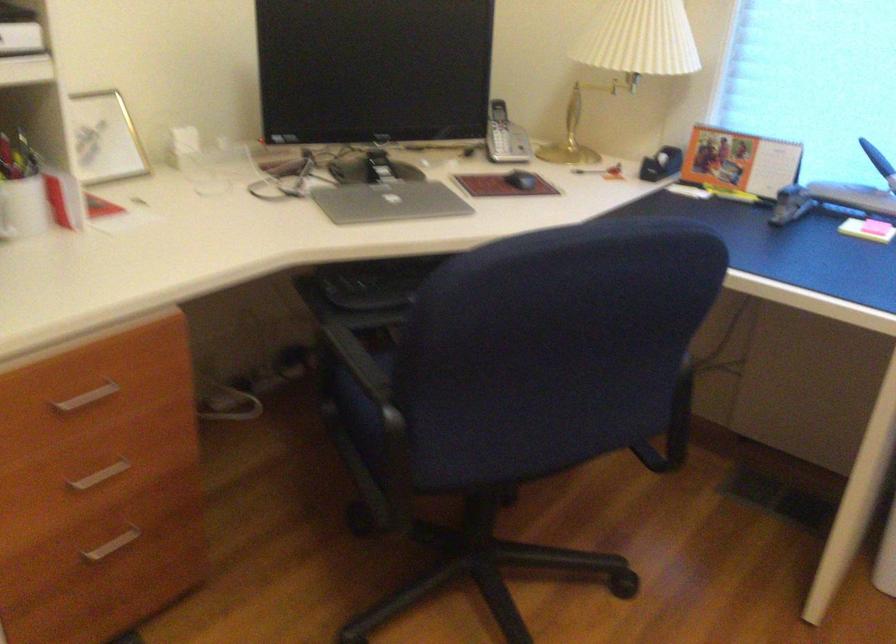
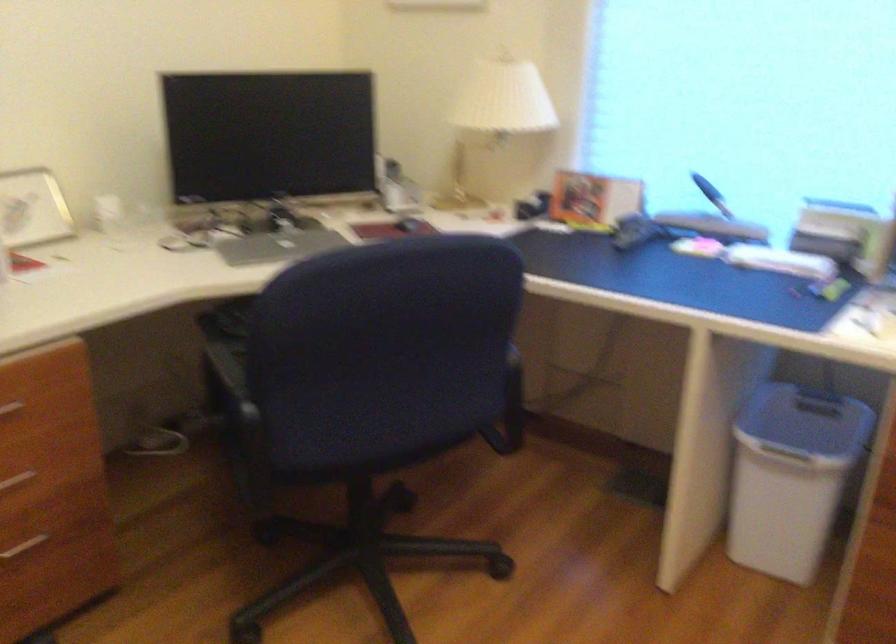
Which direction would the cameraman need to move to produce the second image?

The cameraman moved toward right, backward.